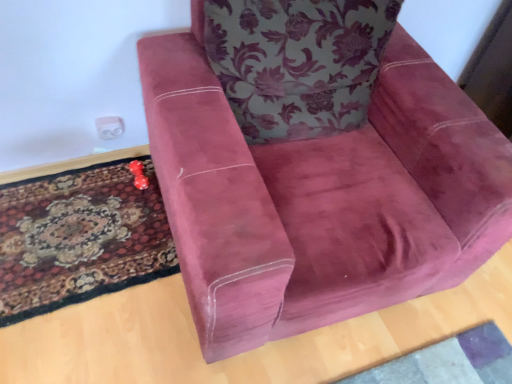
At what (x,y) coordinates should I click in order to perform the action: click on vacant area situated to the left side of velvet maroon armchair at center. Please return your answer as a coordinate pair (x, y). Looking at the image, I should click on (86, 238).